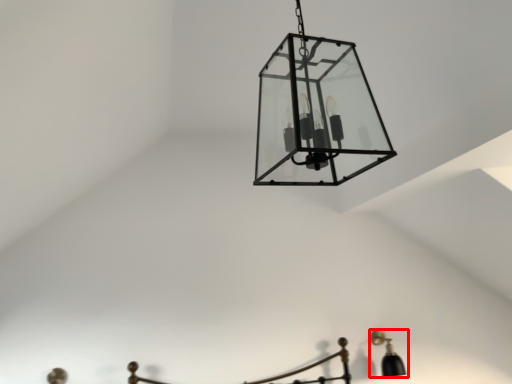
Question: Considering the relative positions of lamp (annotated by the red box) and lamp in the image provided, where is lamp (annotated by the red box) located with respect to the staircase?

Choices:
 (A) left
 (B) right

Answer: (B)